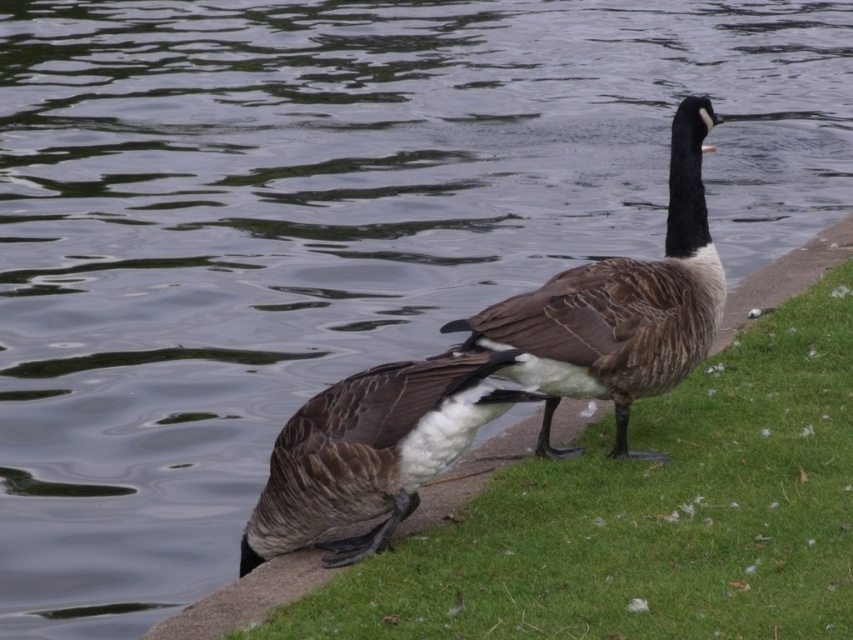
Question: From the image, what is the correct spatial relationship of green grass at lower right in relation to brown speckled duck at center?

Choices:
 (A) above
 (B) below

Answer: (A)

Question: Is green grass at lower right closer to camera compared to brown speckled duck at center?

Choices:
 (A) no
 (B) yes

Answer: (B)

Question: Is brown speckled goose at center further to camera compared to brown speckled duck at center?

Choices:
 (A) yes
 (B) no

Answer: (A)

Question: Based on their relative distances, which object is nearer to the green grass at lower right?

Choices:
 (A) brown speckled duck at center
 (B) brown speckled goose at center

Answer: (A)

Question: Which of these objects is positioned closest to the brown speckled goose at center?

Choices:
 (A) green grass at lower right
 (B) brown speckled duck at center

Answer: (B)

Question: Which point is closer to the camera taking this photo?

Choices:
 (A) (271, 541)
 (B) (674, 611)
 (C) (670, 301)

Answer: (B)